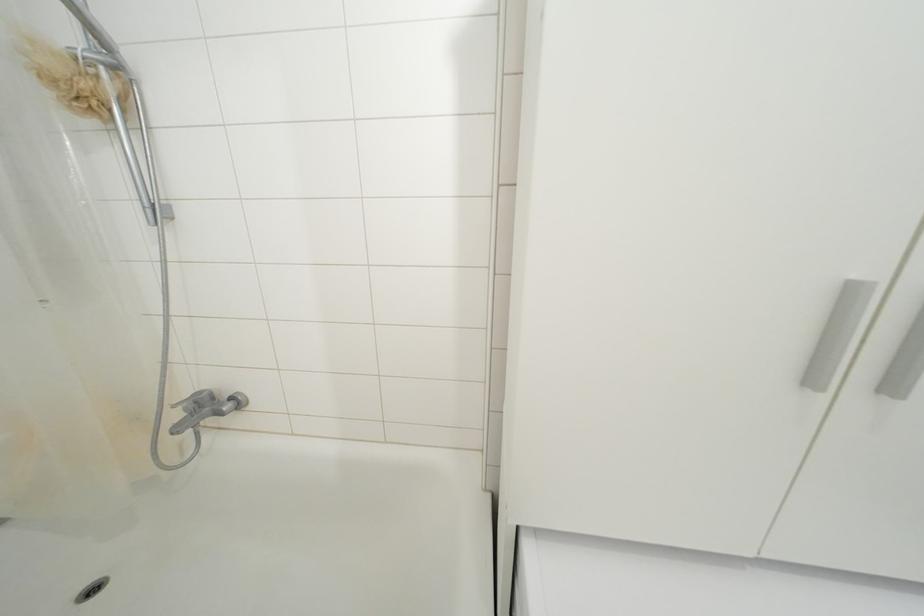
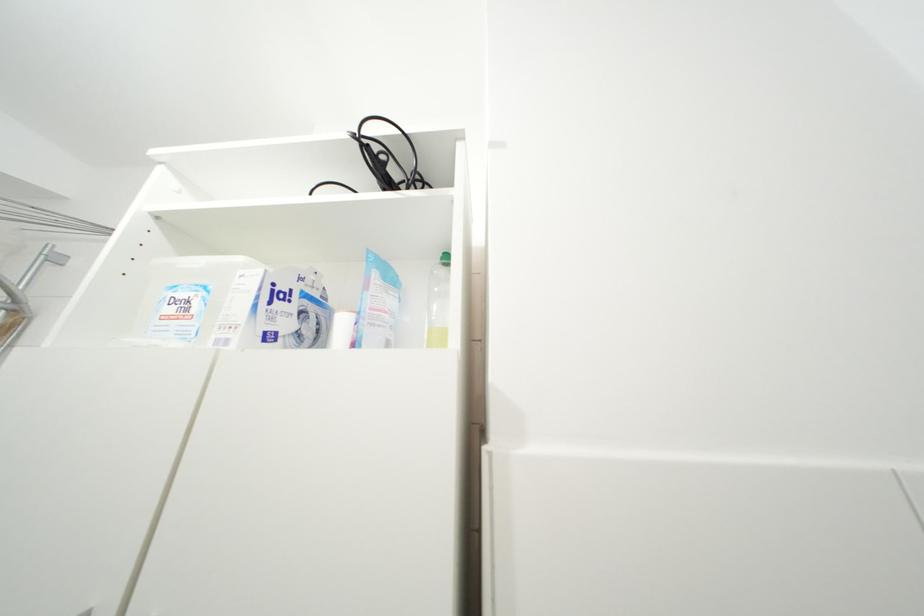
Question: How did the camera likely rotate?

Choices:
 (A) Left
 (B) Right
 (C) Up
 (D) Down

Answer: (C)